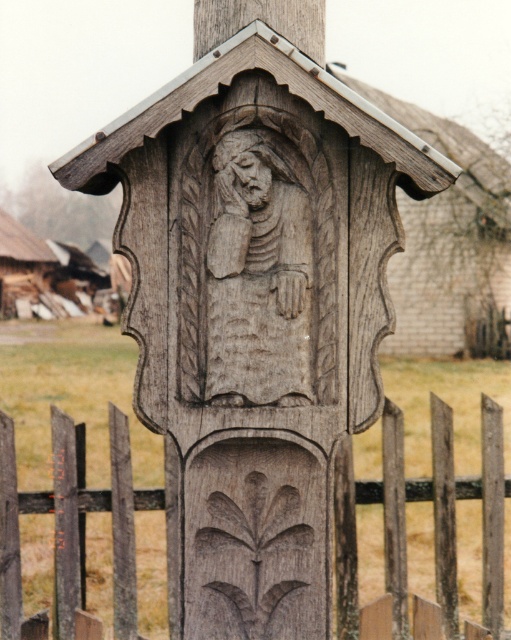
You are a photographer standing at the base of the wooden structure. You want to take a photo of the weathered wood fence at lower center without including the carved figure of Jesus Christ. Is the fence close enough to be in focus if your camera has a depth of field that can sharply capture objects within 10 feet?

The weathered wood fence at lower center is 10.14 feet away from the camera. Since the camera can only sharply capture objects within 10 feet, the fence is slightly beyond the depth of field range and may not be in focus.

You are a photographer taking a picture of the carved wooden post. You notice two points on the carving labeled as point 1 and point 2. Point 1 is at coordinate (x=124, y=602) and point 2 is at (x=218, y=195). If you want to focus on the part closer to you, which point should you adjust your camera to focus on?

Point 2 at coordinate (x=218, y=195) is closer to the camera than point 1 at (x=124, y=602). Therefore, to focus on the closer part, adjust your camera to focus on point 2 at (x=218, y=195).

You are standing in front of the wooden structure and want to touch both the weathered wood fence at lower center and the carved wood face at center. Which object should you reach down to first?

You should reach down to the weathered wood fence at lower center first since it is located below the carved wood face at center, making it lower and easier to access.